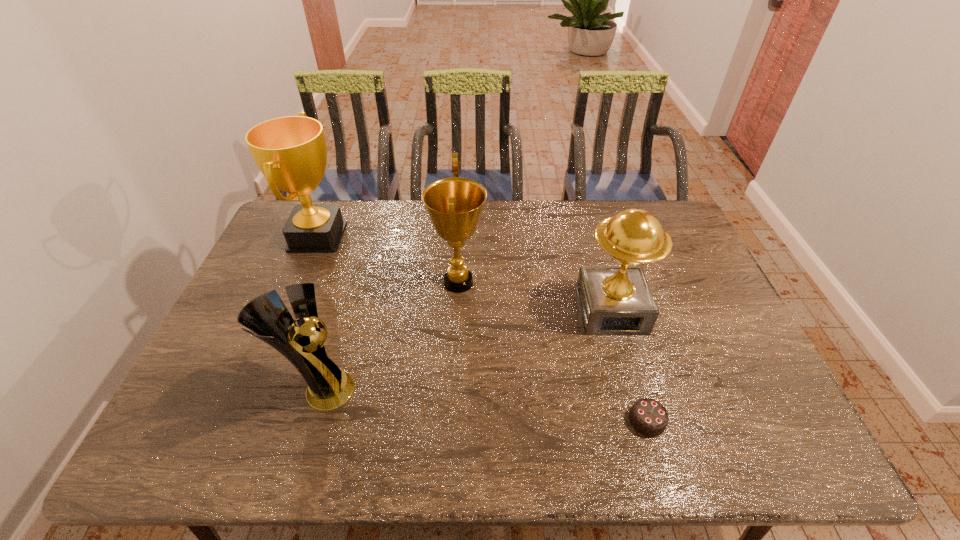
Where is `unoccupied position between the nearest award and the rightmost award`? The image size is (960, 540). unoccupied position between the nearest award and the rightmost award is located at coordinates (466, 350).

I want to click on vacant space that is in between the nearest award and the chocolate cake, so click(484, 405).

This screenshot has width=960, height=540. Identify the location of free space that is in between the nearest award and the shortest object. (484, 405).

I want to click on free area in between the third object from left to right and the rightmost award, so click(x=535, y=296).

Find the location of a particular element. Image resolution: width=960 pixels, height=540 pixels. object identified as the closest to the second award from right to left is located at coordinates (329, 387).

Identify the location of object that stands as the third closest to the nearest award. (614, 300).

I want to click on the closest award to the third object from left to right, so click(x=329, y=387).

Where is `the third closest award relative to the second award from right to left`? the third closest award relative to the second award from right to left is located at coordinates (291, 152).

The image size is (960, 540). Identify the location of free space that satisfies the following two spatial constraints: 1. on the front-facing side of the rightmost award; 2. on the left side of the shortest object. (642, 421).

The height and width of the screenshot is (540, 960). In order to click on vacant region that satisfies the following two spatial constraints: 1. on the front-facing side of the rightmost award; 2. at the front of the nearest award, where the globe is visible in this screenshot , I will do `click(634, 390)`.